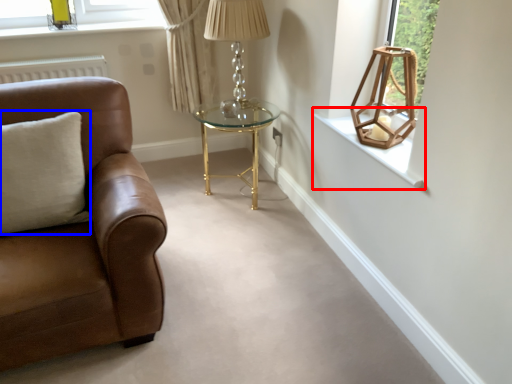
Question: Which object appears closest to the camera in this image, window sill (highlighted by a red box) or pillow (highlighted by a blue box)?

Choices:
 (A) window sill
 (B) pillow

Answer: (B)